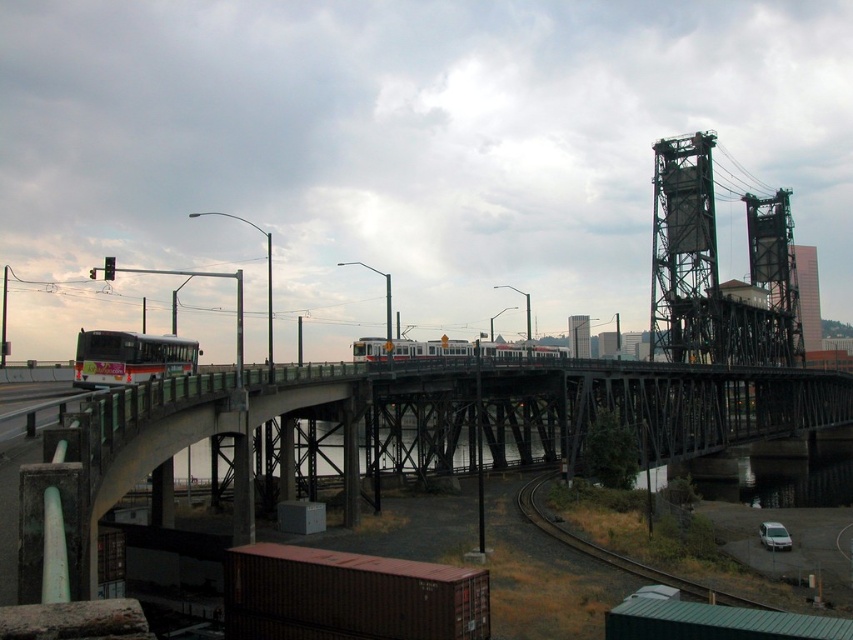
Looking at this image, who is positioned more to the right, white matte bus at left or dark gray metal train track at lower right?

dark gray metal train track at lower right

Is point (131, 356) farther from viewer compared to point (532, 504)?

No, it is in front of (532, 504).

Where is `white matte bus at left`? This screenshot has width=853, height=640. white matte bus at left is located at coordinates (131, 356).

Who is more forward, (194, 404) or (190, 358)?

Positioned in front is point (194, 404).

Can you confirm if concrete bridge at center is smaller than white matte bus at left?

No.

Identify the location of concrete bridge at center. (436, 417).

The height and width of the screenshot is (640, 853). Find the location of `concrete bridge at center`. concrete bridge at center is located at coordinates (436, 417).

Which is below, concrete bridge at center or dark gray metal train track at lower right?

dark gray metal train track at lower right is below.

This screenshot has width=853, height=640. In order to click on concrete bridge at center in this screenshot , I will do `click(436, 417)`.

At what (x,y) coordinates should I click in order to perform the action: click on concrete bridge at center. Please return your answer as a coordinate pair (x, y). This screenshot has height=640, width=853. Looking at the image, I should click on (436, 417).